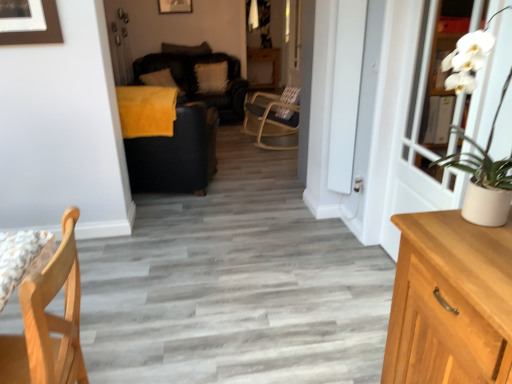
Question: From a real-world perspective, relative to dark gray fabric pillow at upper center, the second pillow in the left-to-right sequence, is velvet black couch at center vertically above or below?

Choices:
 (A) above
 (B) below

Answer: (B)

Question: Is velvet black couch at center inside the boundaries of dark gray fabric pillow at upper center, which appears as the second pillow when viewed from the right, or outside?

Choices:
 (A) inside
 (B) outside

Answer: (B)

Question: Based on their relative distances, which object is nearer to the dark gray fabric pillow at upper center, which appears as the second pillow when viewed from the right?

Choices:
 (A) light wood chair at lower left
 (B) wooden picture frame at upper center
 (C) soft yellow pillow at upper center, the 3th pillow viewed from the right
 (D) white fluffy pillow at center, which is the first pillow in right-to-left order
 (E) white wooden door at right

Answer: (D)

Question: Which object is positioned farthest from the light wood chair at lower left?

Choices:
 (A) velvet black couch at center
 (B) white wooden door at right
 (C) dark gray fabric pillow at upper center, which appears as the second pillow when viewed from the right
 (D) soft yellow pillow at upper center, placed as the 1th pillow when sorted from left to right
 (E) white glossy screen door at right

Answer: (C)